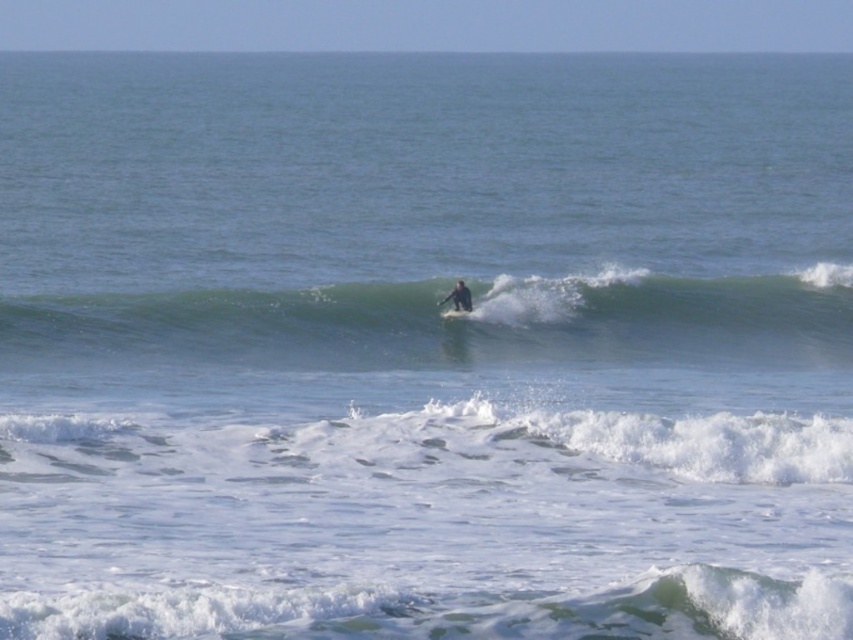
Does green rubber surfboard at center appear under white foam surfboard at center?

Actually, green rubber surfboard at center is above white foam surfboard at center.

Is green rubber surfboard at center thinner than white foam surfboard at center?

Incorrect, green rubber surfboard at center's width is not less than white foam surfboard at center's.

The height and width of the screenshot is (640, 853). What do you see at coordinates (445, 323) in the screenshot? I see `green rubber surfboard at center` at bounding box center [445, 323].

Locate an element on the screen. green rubber surfboard at center is located at coordinates (445, 323).

Does point (73, 312) come in front of point (306, 611)?

No, (73, 312) is behind (306, 611).

Does green rubber surfboard at center appear on the left side of white frothy wave at lower center?

No, green rubber surfboard at center is not to the left of white frothy wave at lower center.

This screenshot has height=640, width=853. Describe the element at coordinates (445, 323) in the screenshot. I see `green rubber surfboard at center` at that location.

At what (x,y) coordinates should I click in order to perform the action: click on green rubber surfboard at center. Please return your answer as a coordinate pair (x, y). Looking at the image, I should click on (445, 323).

Looking at this image, does dark blue wetsuit at center have a greater height compared to white foam surfboard at center?

Correct, dark blue wetsuit at center is much taller as white foam surfboard at center.

Who is more forward, (461, 296) or (460, 312)?

Point (460, 312) is more forward.

Measure the distance between point (462, 308) and camera.

They are 28.54 meters apart.

Find the location of a particular element. Image resolution: width=853 pixels, height=640 pixels. dark blue wetsuit at center is located at coordinates (459, 298).